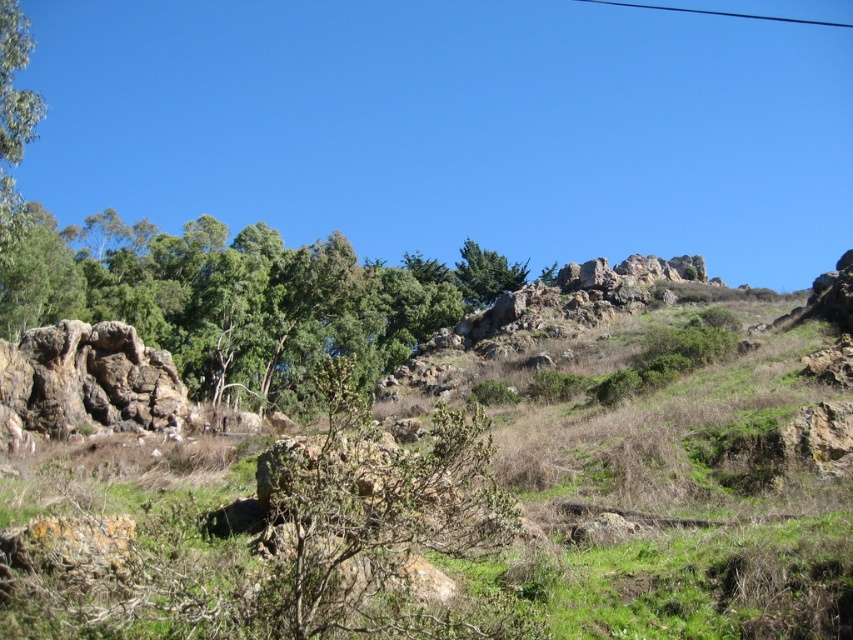
Question: Which point is closer to the camera?

Choices:
 (A) green textured tree at upper center
 (B) green rough rock at upper center

Answer: (B)

Question: Is green leafy tree at upper left above green textured tree at upper center?

Choices:
 (A) no
 (B) yes

Answer: (A)

Question: Can you confirm if green rough rock at upper center is thinner than green leafy tree at upper left?

Choices:
 (A) no
 (B) yes

Answer: (A)

Question: Does green rough rock at upper center appear on the left side of green textured tree at upper center?

Choices:
 (A) no
 (B) yes

Answer: (B)

Question: Which of these objects is positioned farthest from the green rough rock at upper center?

Choices:
 (A) green textured tree at upper center
 (B) green leafy tree at upper left

Answer: (B)

Question: Considering the real-world distances, which object is farthest from the green rough rock at upper center?

Choices:
 (A) green leafy tree at upper left
 (B) green textured tree at upper center

Answer: (A)